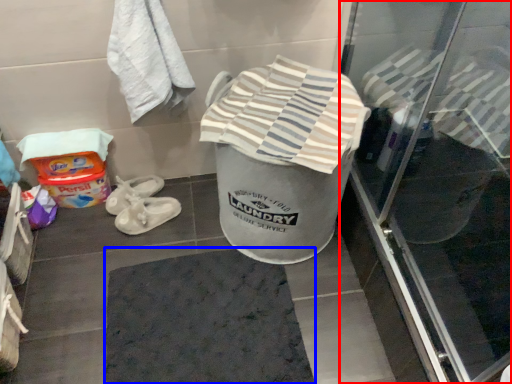
Question: Which of the following is the farthest to the observer, screen door (highlighted by a red box) or bath mat (highlighted by a blue box)?

Choices:
 (A) screen door
 (B) bath mat

Answer: (B)